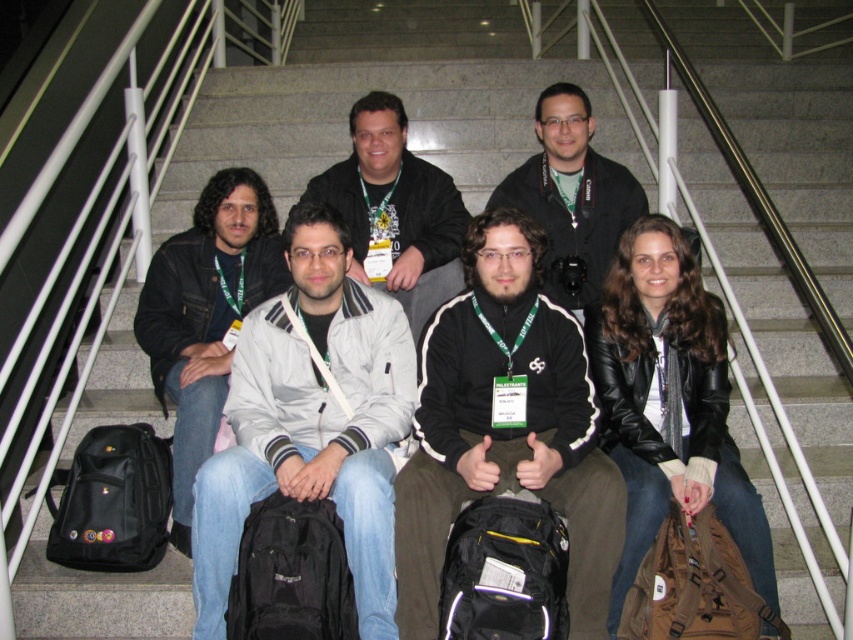
You are standing at the viewer position in the image. There is a point at coordinates point (741, 496). If you want to place a small table at that point, will it be within your reach without moving? The table requires a reach distance of 10 feet.

The point at (741, 496) is 10.71 feet away from you. Since the required reach distance is 10 feet, it is slightly out of reach without moving.

Based on the photo, you are a photographer at the event and need to capture a photo of both the black leather jacket at lower right and the matte black jacket at center. Considering their heights, which jacket will appear larger in the photo?

The black leather jacket at lower right will appear larger in the photo because it is much taller than the matte black jacket at center.

You are standing at the bottom of the staircase where the group is sitting. You need to locate the black leather jacket at lower right. According to the coordinates provided, where exactly is it positioned?

The black leather jacket at lower right is positioned at coordinates point (x=669, y=403).